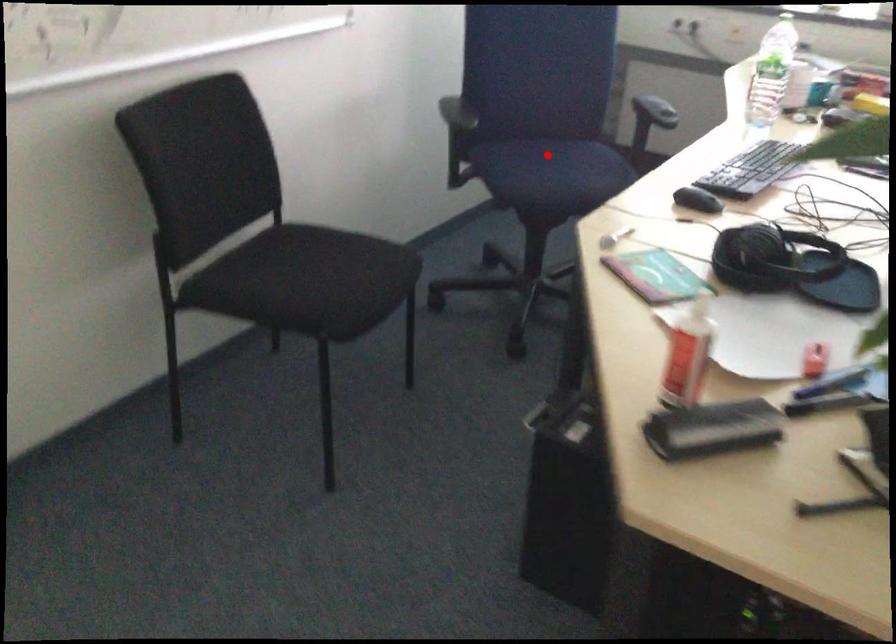
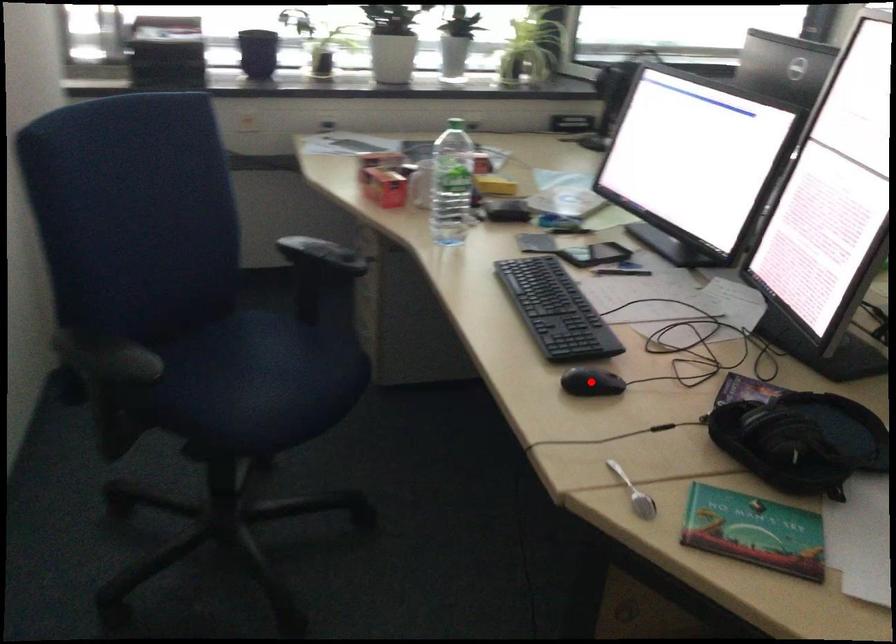
I am providing you with two images of the same scene from different viewpoints. A red point is marked on the first image and another point is marked on the second image. Is the red point in image1 aligned with the point shown in image2?

No